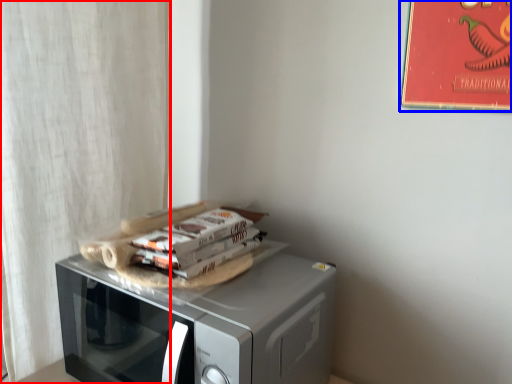
Question: Which object is further to the camera taking this photo, curtain (highlighted by a red box) or bulletin board (highlighted by a blue box)?

Choices:
 (A) curtain
 (B) bulletin board

Answer: (A)